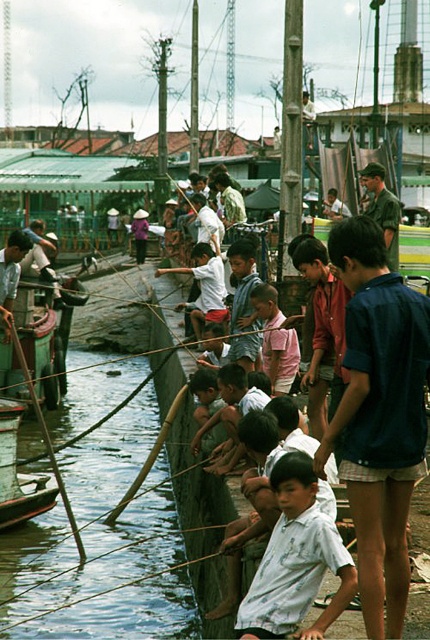
Between dark blue shirt at center and pink cotton shirt at center, which one has more height?

With more height is dark blue shirt at center.

Can you confirm if dark blue shirt at center is bigger than pink cotton shirt at center?

Indeed, dark blue shirt at center has a larger size compared to pink cotton shirt at center.

Does point (383, 532) come in front of point (285, 332)?

Yes, it is.

The height and width of the screenshot is (640, 430). Find the location of `dark blue shirt at center`. dark blue shirt at center is located at coordinates (378, 416).

Is white cotton shirt at center to the left of wooden boat at lower left from the viewer's perspective?

No, white cotton shirt at center is not to the left of wooden boat at lower left.

Who is shorter, white cotton shirt at center or wooden boat at lower left?

With less height is white cotton shirt at center.

What do you see at coordinates (295, 560) in the screenshot? I see `white cotton shirt at center` at bounding box center [295, 560].

Find the location of `white cotton shirt at center`. white cotton shirt at center is located at coordinates (295, 560).

Who is positioned more to the left, wooden boat at lower left or pink cotton shirt at center?

From the viewer's perspective, wooden boat at lower left appears more on the left side.

Does wooden boat at lower left come behind pink cotton shirt at center?

That is False.

Between point (33, 509) and point (270, 289), which one is positioned in front?

Point (33, 509) is more forward.

Locate an element on the screen. The height and width of the screenshot is (640, 430). wooden boat at lower left is located at coordinates (18, 474).